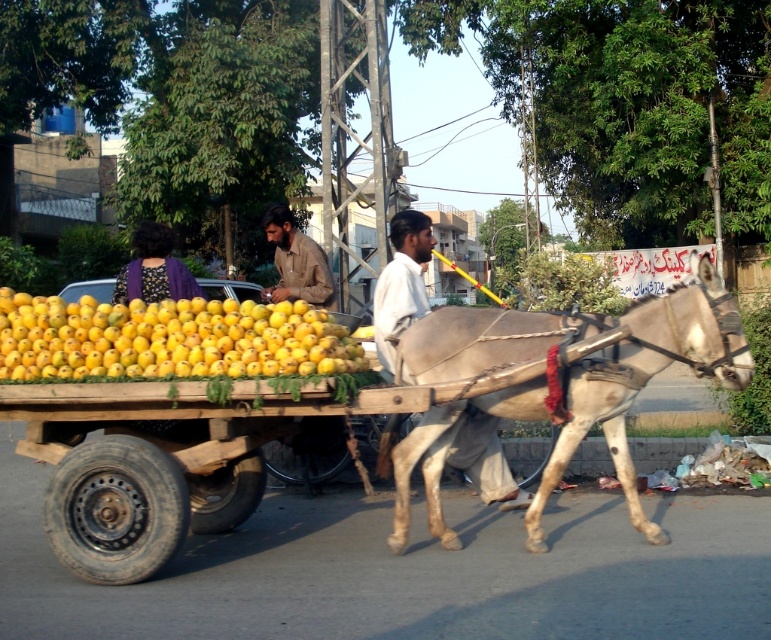
Is point (456, 433) farther from viewer compared to point (322, 291)?

No, it is in front of (322, 291).

Is white cotton shirt at center to the right of brown cotton shirt at center from the viewer's perspective?

Indeed, white cotton shirt at center is positioned on the right side of brown cotton shirt at center.

Identify the location of white cotton shirt at center. The image size is (771, 640). (401, 284).

Does light brown leather harness at center appear on the right side of purple fabric at upper left?

Indeed, light brown leather harness at center is positioned on the right side of purple fabric at upper left.

Can you confirm if light brown leather harness at center is positioned above purple fabric at upper left?

No, light brown leather harness at center is not above purple fabric at upper left.

Describe the element at coordinates (588, 365) in the screenshot. I see `light brown leather harness at center` at that location.

You are a GUI agent. You are given a task and a screenshot of the screen. Output one action in this format:
    pyautogui.click(x=<x>, y=<y>)
    Task: Click on the light brown leather harness at center
    
    Given the screenshot: What is the action you would take?
    pyautogui.click(x=588, y=365)

Between yellow matte mangoes at center and brown cotton shirt at center, which one is positioned lower?

yellow matte mangoes at center is below.

Between point (311, 355) and point (298, 250), which one is positioned behind?

The point (298, 250) is behind.

The height and width of the screenshot is (640, 771). Find the location of `yellow matte mangoes at center`. yellow matte mangoes at center is located at coordinates (167, 339).